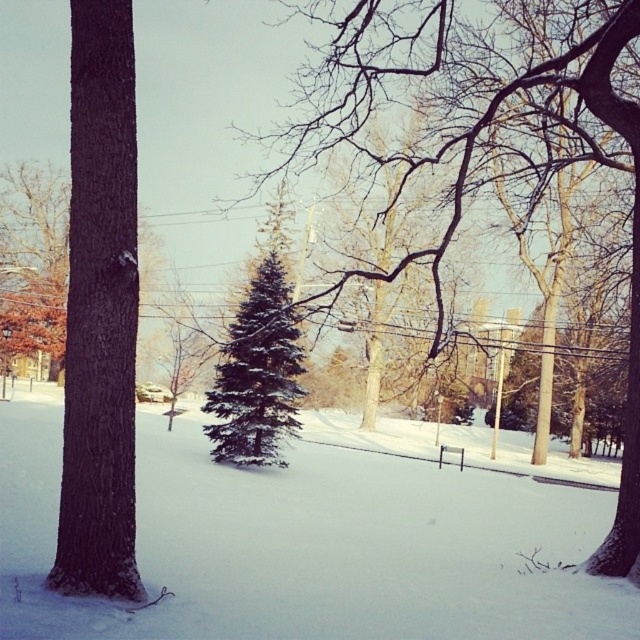
Question: Which object is farther from the camera taking this photo?

Choices:
 (A) brown rough bark tree at left
 (B) white fluffy snow at center
 (C) green matte evergreen tree at center

Answer: (C)

Question: Which point is farther from the camera taking this photo?

Choices:
 (A) (189, 554)
 (B) (115, 529)
 (C) (276, 449)

Answer: (C)

Question: Which of the following is the closest to the observer?

Choices:
 (A) brown rough bark tree at left
 (B) green matte evergreen tree at center
 (C) white fluffy snow at center

Answer: (C)

Question: From the image, what is the correct spatial relationship of brown rough bark tree at left in relation to green matte evergreen tree at center?

Choices:
 (A) below
 (B) above

Answer: (B)

Question: Is white fluffy snow at center further to the viewer compared to green matte evergreen tree at center?

Choices:
 (A) yes
 (B) no

Answer: (B)

Question: Can you confirm if white fluffy snow at center is wider than green matte evergreen tree at center?

Choices:
 (A) yes
 (B) no

Answer: (A)